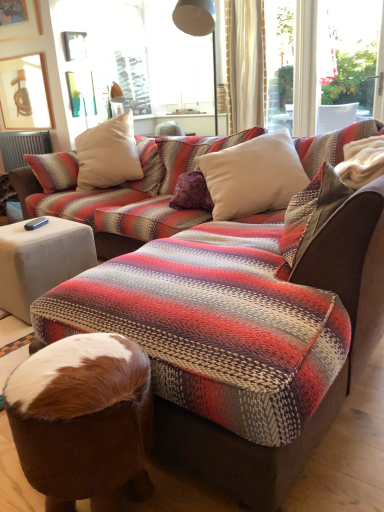
The height and width of the screenshot is (512, 384). I want to click on wooden picture frame at upper left, so click(x=25, y=93).

What are the coordinates of `white soft cushion at center, the second pillow when ordered from front to back` in the screenshot? It's located at (253, 176).

This screenshot has height=512, width=384. Describe the element at coordinates (83, 419) in the screenshot. I see `brown fur bean bag chair at lower center` at that location.

What is the approximate height of white fabric side table at lower left?

white fabric side table at lower left is 42.85 centimeters tall.

Where is `wooden picture frame at upper left`? Image resolution: width=384 pixels, height=512 pixels. wooden picture frame at upper left is located at coordinates (25, 93).

Is white soft cushion at upper center, arranged as the first pillow when viewed from the front, not within brown fur bean bag chair at lower center?

Yes, white soft cushion at upper center, arranged as the first pillow when viewed from the front, is located beyond the bounds of brown fur bean bag chair at lower center.

Is brown fur bean bag chair at lower center at the back of white soft cushion at upper center, the 2th pillow in the back-to-front sequence?

That's not correct — white soft cushion at upper center, the 2th pillow in the back-to-front sequence, is not looking away from brown fur bean bag chair at lower center.

Based on the photo, is white soft cushion at upper center, the 2th pillow in the back-to-front sequence, positioned behind brown fur bean bag chair at lower center?

Yes, white soft cushion at upper center, the 2th pillow in the back-to-front sequence, is further from the camera.

In the scene shown: Between white soft cushion at upper center, the 2th pillow in the back-to-front sequence, and brown fur bean bag chair at lower center, which one has larger size?

With larger size is white soft cushion at upper center, the 2th pillow in the back-to-front sequence.

Considering the relative positions of white soft cushion at upper center, arranged as the first pillow when viewed from the front, and white fabric side table at lower left in the image provided, is white soft cushion at upper center, arranged as the first pillow when viewed from the front, in front of white fabric side table at lower left?

Yes, the depth of white soft cushion at upper center, arranged as the first pillow when viewed from the front, is less than that of white fabric side table at lower left.

From their relative heights in the image, would you say white soft cushion at upper center, the 2th pillow in the back-to-front sequence, is taller or shorter than white fabric side table at lower left?

white soft cushion at upper center, the 2th pillow in the back-to-front sequence, is shorter than white fabric side table at lower left.

From the image's perspective, is white fabric side table at lower left above white soft cushion at upper center, the 2th pillow in the back-to-front sequence?

No, from the image's perspective, white fabric side table at lower left is not above white soft cushion at upper center, the 2th pillow in the back-to-front sequence.

Is white fabric side table at lower left oriented towards white soft cushion at upper center, the 2th pillow in the back-to-front sequence?

No, white fabric side table at lower left does not turn towards white soft cushion at upper center, the 2th pillow in the back-to-front sequence.

Is white fabric side table at lower left bigger than white soft cushion at upper center, the 2th pillow in the back-to-front sequence?

Indeed, white fabric side table at lower left has a larger size compared to white soft cushion at upper center, the 2th pillow in the back-to-front sequence.

Which object is thinner, white fabric side table at lower left or brown fur bean bag chair at lower center?

With smaller width is brown fur bean bag chair at lower center.

Is white fabric side table at lower left far from brown fur bean bag chair at lower center?

Yes.

Based on their positions, is white fabric side table at lower left located to the left or right of brown fur bean bag chair at lower center?

From the image, it's evident that white fabric side table at lower left is to the left of brown fur bean bag chair at lower center.

From the image's perspective, is white fabric side table at lower left beneath brown fur bean bag chair at lower center?

Actually, white fabric side table at lower left appears above brown fur bean bag chair at lower center in the image.

From the image's perspective, relative to wooden picture frame at upper left, is white soft cushion at upper center, the 2th pillow in the back-to-front sequence, above or below?

white soft cushion at upper center, the 2th pillow in the back-to-front sequence, is situated lower than wooden picture frame at upper left in the image.

Who is bigger, white soft cushion at upper center, arranged as the first pillow when viewed from the front, or wooden picture frame at upper left?

With larger size is white soft cushion at upper center, arranged as the first pillow when viewed from the front.

Is white soft cushion at upper center, the 2th pillow in the back-to-front sequence, far away from wooden picture frame at upper left?

That's right, there is a large distance between white soft cushion at upper center, the 2th pillow in the back-to-front sequence, and wooden picture frame at upper left.

Locate an element on the screen. picture frame located on the left of white soft cushion at upper center, the 2th pillow in the back-to-front sequence is located at coordinates tap(25, 93).

Considering the relative positions of wooden picture frame at upper left and white soft cushion at upper center, the 2th pillow in the back-to-front sequence, in the image provided, is wooden picture frame at upper left in front of white soft cushion at upper center, the 2th pillow in the back-to-front sequence,?

No, it is behind white soft cushion at upper center, the 2th pillow in the back-to-front sequence.

Is point (2, 98) positioned behind point (305, 189)?

That is True.

Is wooden picture frame at upper left facing towards white soft cushion at upper center, arranged as the first pillow when viewed from the front?

No, wooden picture frame at upper left is not oriented towards white soft cushion at upper center, arranged as the first pillow when viewed from the front.

Based on the photo, does wooden picture frame at upper left have a greater width compared to white soft cushion at upper center, arranged as the first pillow when viewed from the front?

In fact, wooden picture frame at upper left might be narrower than white soft cushion at upper center, arranged as the first pillow when viewed from the front.

Is brown fur bean bag chair at lower center facing away from white soft cushion at center, the second pillow when ordered from front to back?

Yes, white soft cushion at center, the second pillow when ordered from front to back, is at the back of brown fur bean bag chair at lower center.

In the scene shown: Is brown fur bean bag chair at lower center in front of or behind white soft cushion at center, the second pillow when ordered from front to back, in the image?

In the image, brown fur bean bag chair at lower center appears in front of white soft cushion at center, the second pillow when ordered from front to back.

Is point (63, 500) farther from camera compared to point (283, 173)?

No.

Based on the photo, in terms of size, does brown fur bean bag chair at lower center appear bigger or smaller than white soft cushion at center, acting as the 1th pillow starting from the back?

Considering their sizes, brown fur bean bag chair at lower center takes up less space than white soft cushion at center, acting as the 1th pillow starting from the back.

In order to click on pillow that is the 2nd one above the brown fur bean bag chair at lower center (from a real-world perspective) in this screenshot , I will do `click(309, 215)`.

You are a GUI agent. You are given a task and a screenshot of the screen. Output one action in this format:
    pyautogui.click(x=<x>, y=<y>)
    Task: Click on the pillow in front of the white fabric side table at lower left
    The width and height of the screenshot is (384, 512).
    Given the screenshot: What is the action you would take?
    pyautogui.click(x=309, y=215)

Considering their positions, is white soft cushion at center, acting as the 1th pillow starting from the back, positioned closer to wooden picture frame at upper left than matte metal lampshade at upper center?

matte metal lampshade at upper center is closer to wooden picture frame at upper left.

Looking at the image, which one is located further to brown fur bean bag chair at lower center, white fabric side table at lower left or wooden picture frame at upper left?

wooden picture frame at upper left.

Considering their positions, is white soft cushion at upper center, arranged as the first pillow when viewed from the front, positioned closer to matte metal lampshade at upper center than white fabric side table at lower left?

The object closer to matte metal lampshade at upper center is white fabric side table at lower left.

From the image, which object appears to be farther from white soft cushion at upper center, arranged as the first pillow when viewed from the front, white fabric side table at lower left or wooden picture frame at upper left?

wooden picture frame at upper left is positioned further to the anchor white soft cushion at upper center, arranged as the first pillow when viewed from the front.

From the image, which object appears to be farther from wooden picture frame at upper left, brown fur bean bag chair at lower center or matte metal lampshade at upper center?

The object further to wooden picture frame at upper left is brown fur bean bag chair at lower center.

When comparing their distances from white soft cushion at center, the second pillow when ordered from front to back, does brown fur bean bag chair at lower center or matte metal lampshade at upper center seem further?

The object further to white soft cushion at center, the second pillow when ordered from front to back, is brown fur bean bag chair at lower center.

Which object lies further to the anchor point white fabric side table at lower left, matte metal lampshade at upper center or white soft cushion at center, acting as the 1th pillow starting from the back?

Among the two, matte metal lampshade at upper center is located further to white fabric side table at lower left.

From the image, which object appears to be nearer to matte metal lampshade at upper center, brown fur bean bag chair at lower center or white fabric side table at lower left?

white fabric side table at lower left is positioned closer to the anchor matte metal lampshade at upper center.

In order to click on side table between brown fur bean bag chair at lower center and wooden picture frame at upper left in the front-back direction in this screenshot , I will do `click(41, 260)`.

This screenshot has height=512, width=384. I want to click on side table located between brown fur bean bag chair at lower center and matte metal lampshade at upper center in the depth direction, so click(x=41, y=260).

Where is `pillow between white soft cushion at upper center, arranged as the first pillow when viewed from the front, and wooden picture frame at upper left, along the z-axis`? This screenshot has height=512, width=384. pillow between white soft cushion at upper center, arranged as the first pillow when viewed from the front, and wooden picture frame at upper left, along the z-axis is located at coordinates (253, 176).

Locate an element on the screen. This screenshot has width=384, height=512. pillow between white fabric side table at lower left and white soft cushion at upper center, the 2th pillow in the back-to-front sequence is located at coordinates (253, 176).